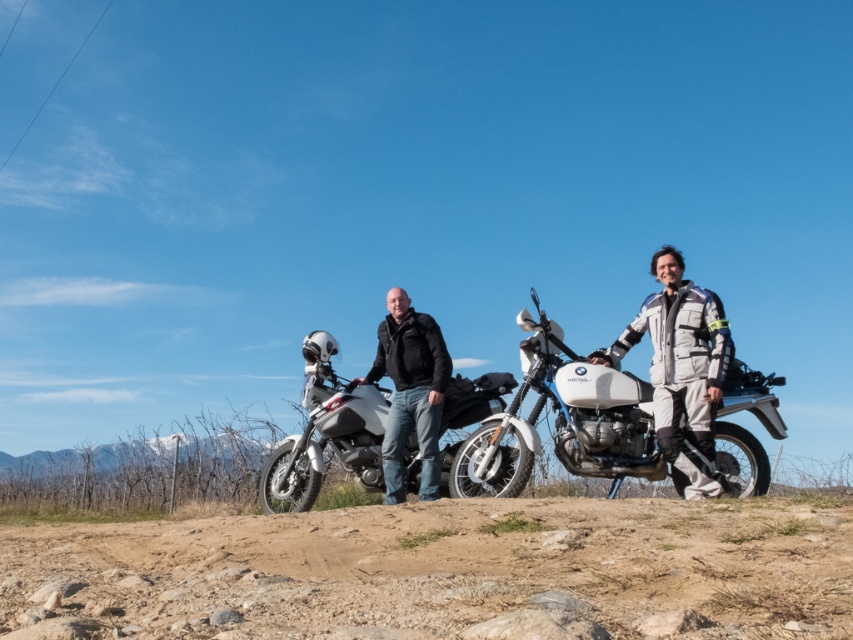
Question: Does white matte motorcycle at center appear on the left side of black matte jacket at center?

Choices:
 (A) yes
 (B) no

Answer: (B)

Question: Which of these objects is positioned farthest from the white matte motorcycle at center?

Choices:
 (A) black matte jacket at center
 (B) gray textured jacket at center
 (C) white matte adventure bike at center

Answer: (C)

Question: Among these objects, which one is farthest from the camera?

Choices:
 (A) dusty brown soil at lower center
 (B) black matte jacket at center
 (C) white matte adventure bike at center
 (D) gray textured jacket at center

Answer: (C)

Question: Where is white matte motorcycle at center located in relation to black matte jacket at center in the image?

Choices:
 (A) right
 (B) left

Answer: (A)

Question: Among these objects, which one is nearest to the camera?

Choices:
 (A) dusty brown soil at lower center
 (B) white matte adventure bike at center

Answer: (A)

Question: Does white matte motorcycle at center have a larger size compared to white matte adventure bike at center?

Choices:
 (A) no
 (B) yes

Answer: (B)